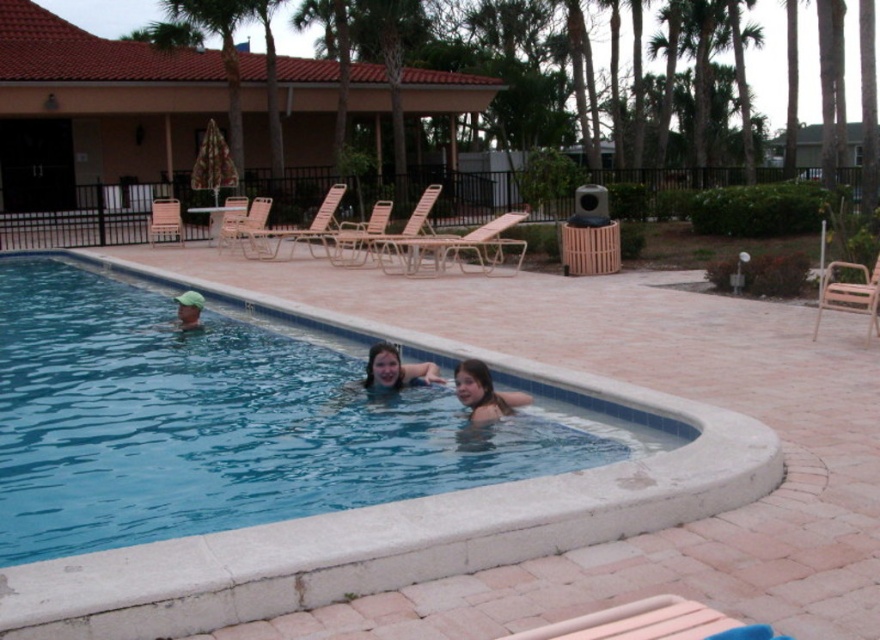
Who is higher up, blue smooth water at center or matte green cap at left?

matte green cap at left is higher up.

Where is `blue smooth water at center`? Image resolution: width=880 pixels, height=640 pixels. blue smooth water at center is located at coordinates (222, 422).

Is blue smooth water at center above smooth skin girl at center?

Actually, blue smooth water at center is below smooth skin girl at center.

Is point (308, 465) closer to viewer compared to point (464, 384)?

That is False.

Is point (187, 500) farther from viewer compared to point (466, 387)?

No, (187, 500) is closer to viewer.

Find the location of `blue smooth water at center`. blue smooth water at center is located at coordinates (222, 422).

Between blue smooth water at center and smooth skin face at center, which one has less height?

With less height is smooth skin face at center.

Can you confirm if blue smooth water at center is wider than smooth skin face at center?

Indeed, blue smooth water at center has a greater width compared to smooth skin face at center.

Locate an element on the screen. blue smooth water at center is located at coordinates (222, 422).